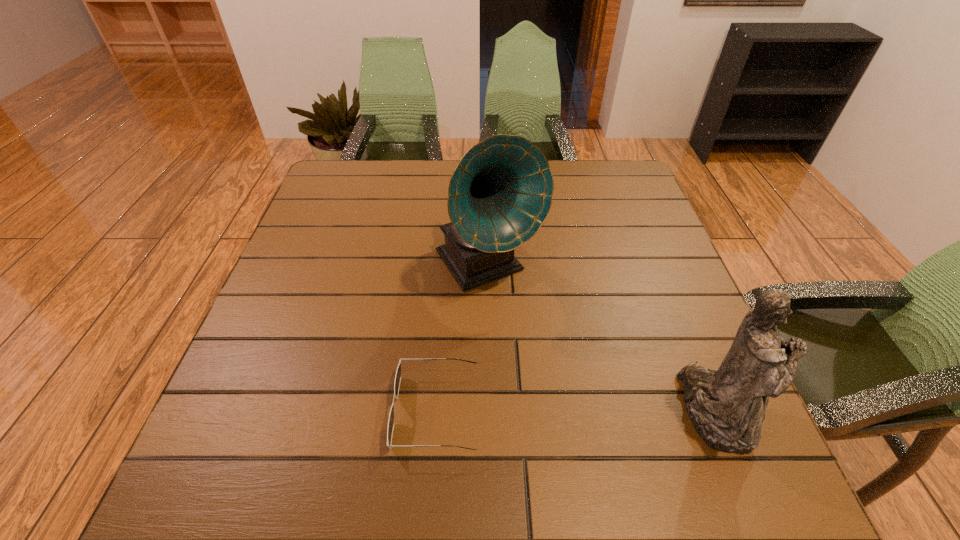
Where is `vacant space at the far right corner`? vacant space at the far right corner is located at coordinates (607, 186).

Locate an element on the screen. Image resolution: width=960 pixels, height=540 pixels. free space between the figurine and the phonograph_record is located at coordinates (601, 339).

The width and height of the screenshot is (960, 540). What are the coordinates of `free spot between the phonograph_record and the sunglasses` in the screenshot? It's located at (462, 339).

Find the location of a particular element. Image resolution: width=960 pixels, height=540 pixels. unoccupied area between the phonograph_record and the second shortest object is located at coordinates (601, 339).

What are the coordinates of `empty space that is in between the rightmost object and the shortest object` in the screenshot? It's located at (576, 411).

Where is `vacant region between the farthest object and the figurine`? Image resolution: width=960 pixels, height=540 pixels. vacant region between the farthest object and the figurine is located at coordinates (601, 339).

You are a GUI agent. You are given a task and a screenshot of the screen. Output one action in this format:
    pyautogui.click(x=<x>, y=<y>)
    Task: Click on the object that can be found as the closest to the sunglasses
    The width and height of the screenshot is (960, 540).
    Given the screenshot: What is the action you would take?
    pyautogui.click(x=500, y=193)

Image resolution: width=960 pixels, height=540 pixels. I want to click on object that stands as the second closest to the farthest object, so click(727, 406).

Where is `free space that satisfies the following two spatial constraints: 1. on the front side of the second shortest object; 2. on the front-facing side of the farthest object`? Image resolution: width=960 pixels, height=540 pixels. free space that satisfies the following two spatial constraints: 1. on the front side of the second shortest object; 2. on the front-facing side of the farthest object is located at coordinates (490, 411).